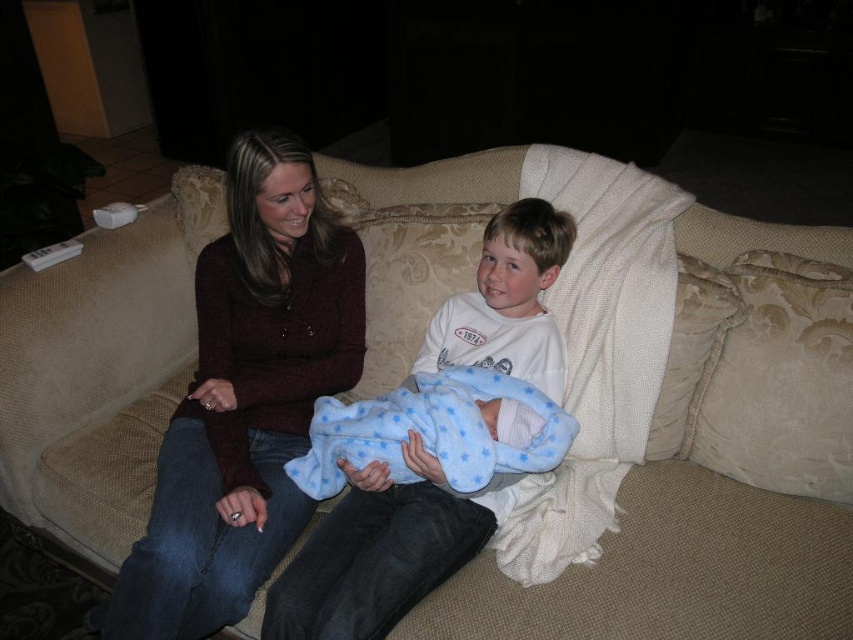
Question: From the image, what is the correct spatial relationship of beige textured pillow at right in relation to beige plush pillow at right?

Choices:
 (A) above
 (B) below

Answer: (B)

Question: Which point is closer to the camera?

Choices:
 (A) matte burgundy sweater at center
 (B) beige textured pillow at right
 (C) blue fleece blanket at center
 (D) beige plush pillow at right

Answer: (A)

Question: Does beige textured pillow at right have a smaller size compared to blue fleece blanket at center?

Choices:
 (A) no
 (B) yes

Answer: (B)

Question: Among these objects, which one is farthest from the camera?

Choices:
 (A) beige plush pillow at right
 (B) beige textured pillow at right

Answer: (A)

Question: Does matte burgundy sweater at center have a larger size compared to beige plush pillow at right?

Choices:
 (A) no
 (B) yes

Answer: (B)

Question: Which is nearer to the white cotton shirt at center?

Choices:
 (A) matte burgundy sweater at center
 (B) blue fleece blanket at center

Answer: (B)